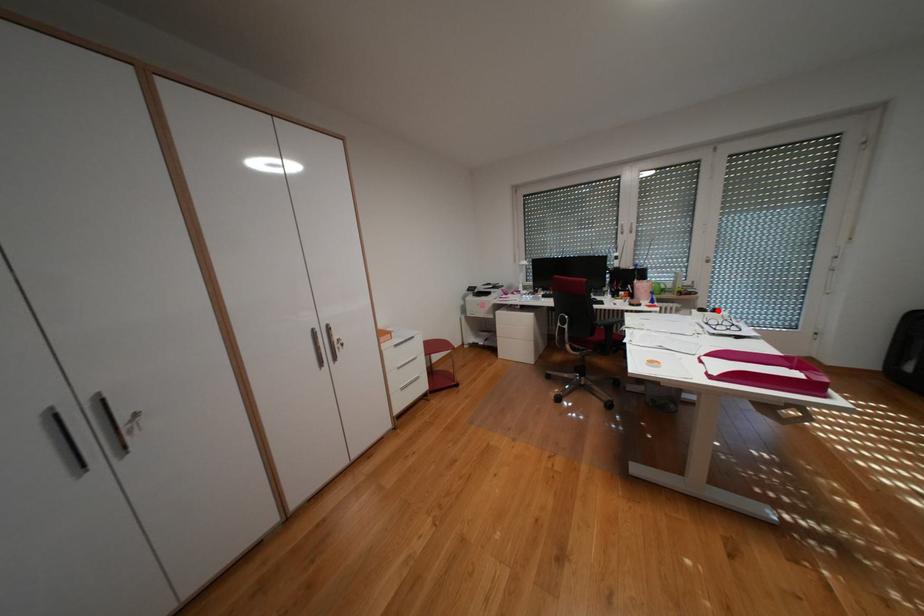
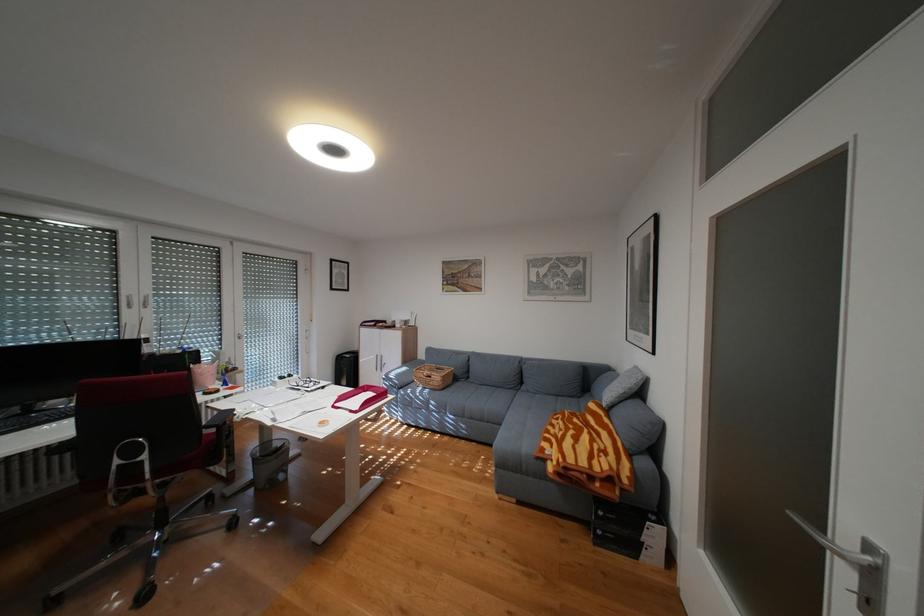
Question: I am providing you with two images of the same scene from different viewpoints. In image1, a red point is highlighted. Considering the same 3D point in image2, which of the following is correct?

Choices:
 (A) It is closer
 (B) It is farther

Answer: (A)